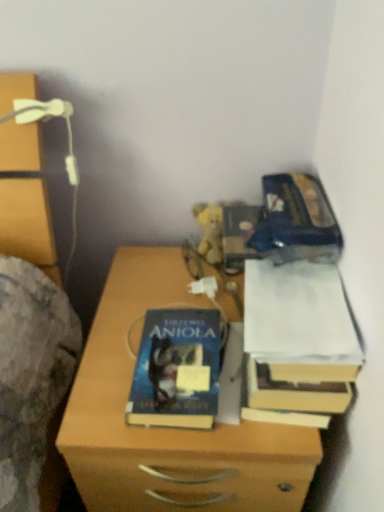
The image size is (384, 512). In order to click on unoccupied space behind hardcover book at center in this screenshot , I will do `click(164, 296)`.